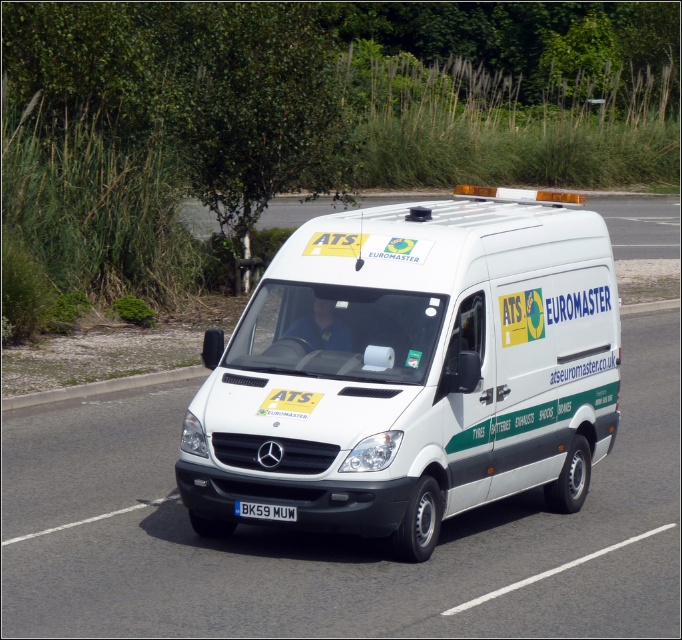
Question: Which point is farther to the camera?

Choices:
 (A) black plastic license plate at lower center
 (B) white matte van at center

Answer: (A)

Question: Which object is closer to the camera taking this photo?

Choices:
 (A) white matte van at center
 (B) black plastic license plate at lower center

Answer: (A)

Question: Which point is farther to the camera?

Choices:
 (A) (265, 513)
 (B) (291, 253)

Answer: (B)

Question: Can you confirm if white matte van at center is smaller than black plastic license plate at lower center?

Choices:
 (A) no
 (B) yes

Answer: (A)

Question: Can you confirm if white matte van at center is positioned above black plastic license plate at lower center?

Choices:
 (A) yes
 (B) no

Answer: (A)

Question: Does white matte van at center have a smaller size compared to black plastic license plate at lower center?

Choices:
 (A) yes
 (B) no

Answer: (B)